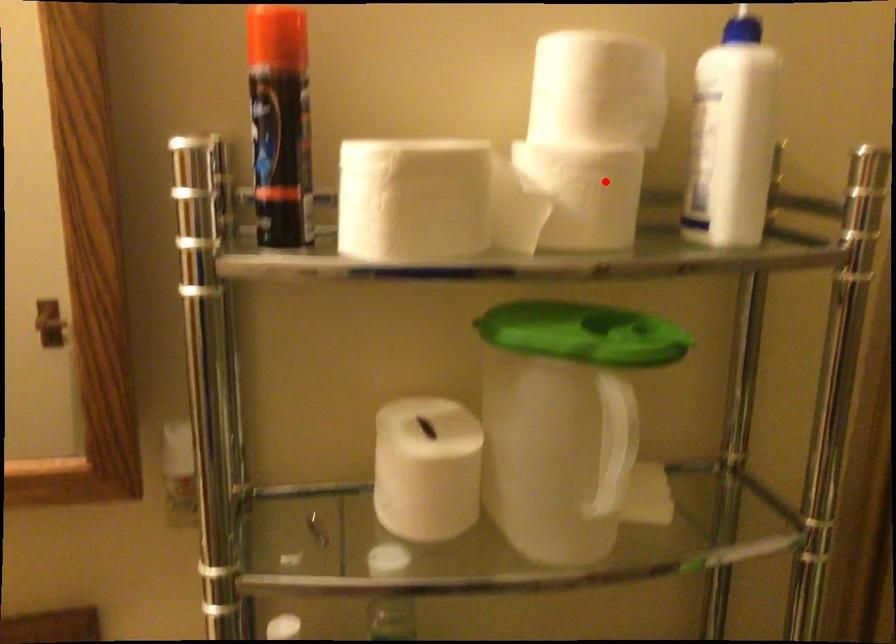
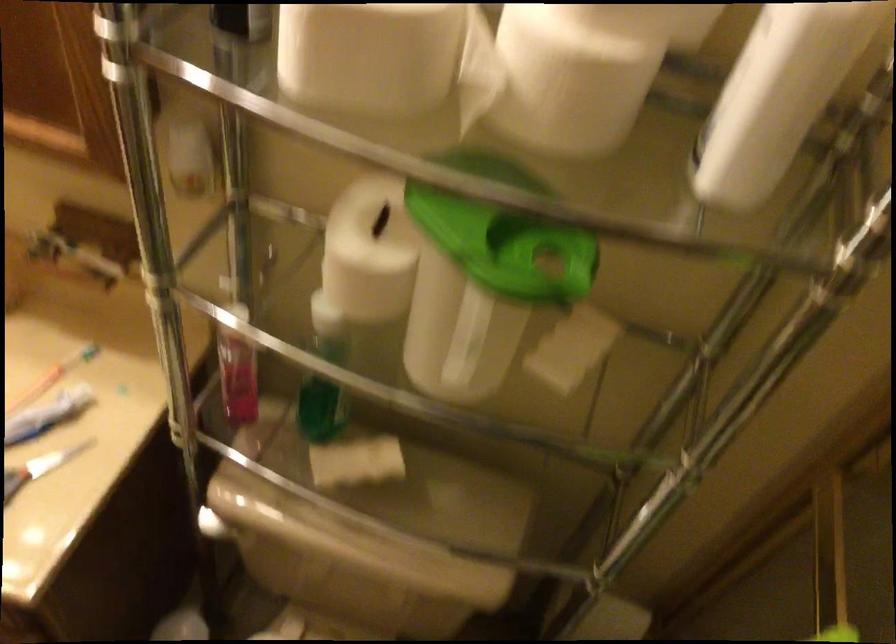
Question: I am providing you with two images of the same scene from different viewpoints. In image1, a red point is highlighted. Considering the same 3D point in image2, which of the following is correct?

Choices:
 (A) It is closer
 (B) It is farther

Answer: (A)